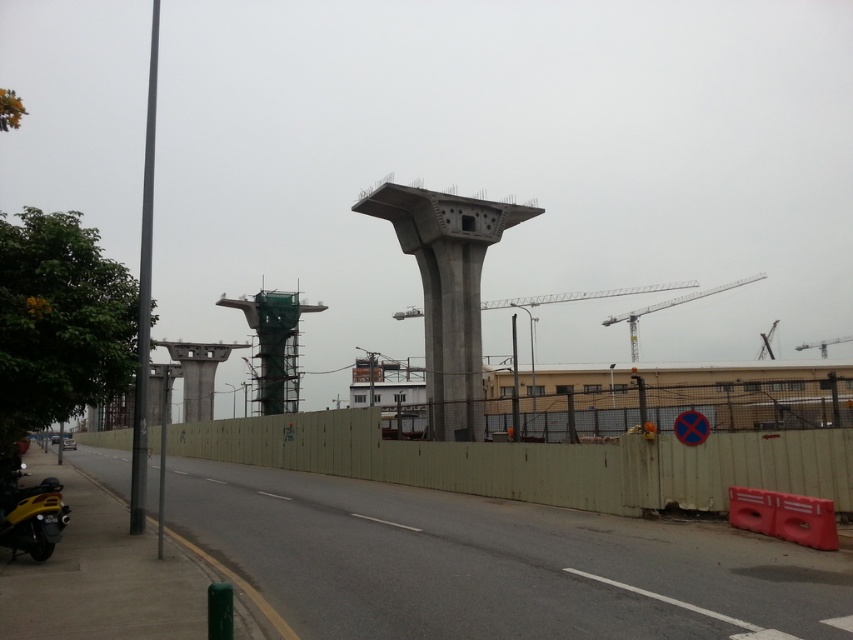
Is point (405, 192) less distant than point (10, 547)?

That is False.

Is concrete at center thinner than yellow matte motorcycle at lower left?

No.

This screenshot has width=853, height=640. In order to click on concrete at center in this screenshot , I will do `click(447, 289)`.

Is yellow matte motorcycle at lower left below metallic gray crane at upper right?

Indeed, yellow matte motorcycle at lower left is positioned under metallic gray crane at upper right.

Where is `yellow matte motorcycle at lower left`? The height and width of the screenshot is (640, 853). yellow matte motorcycle at lower left is located at coordinates pyautogui.click(x=28, y=512).

Is point (10, 472) positioned in front of point (833, 342)?

Yes, it is in front of point (833, 342).

Find the location of a particular element. Image resolution: width=853 pixels, height=640 pixels. yellow matte motorcycle at lower left is located at coordinates (28, 512).

Who is positioned more to the right, green concrete control tower at center or metallic gray crane at upper right?

From the viewer's perspective, metallic gray crane at upper right appears more on the right side.

What do you see at coordinates (274, 346) in the screenshot? I see `green concrete control tower at center` at bounding box center [274, 346].

The height and width of the screenshot is (640, 853). Identify the location of green concrete control tower at center. (274, 346).